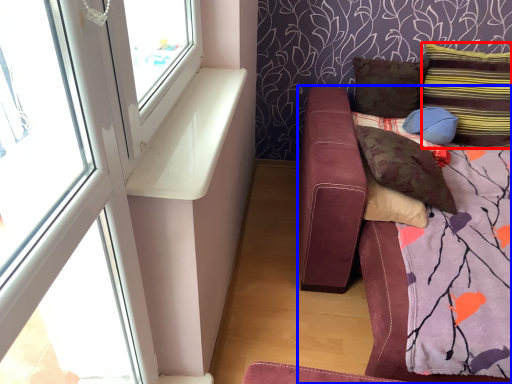
Question: Which object is closer to the camera taking this photo, pillow (highlighted by a red box) or studio couch (highlighted by a blue box)?

Choices:
 (A) pillow
 (B) studio couch

Answer: (B)